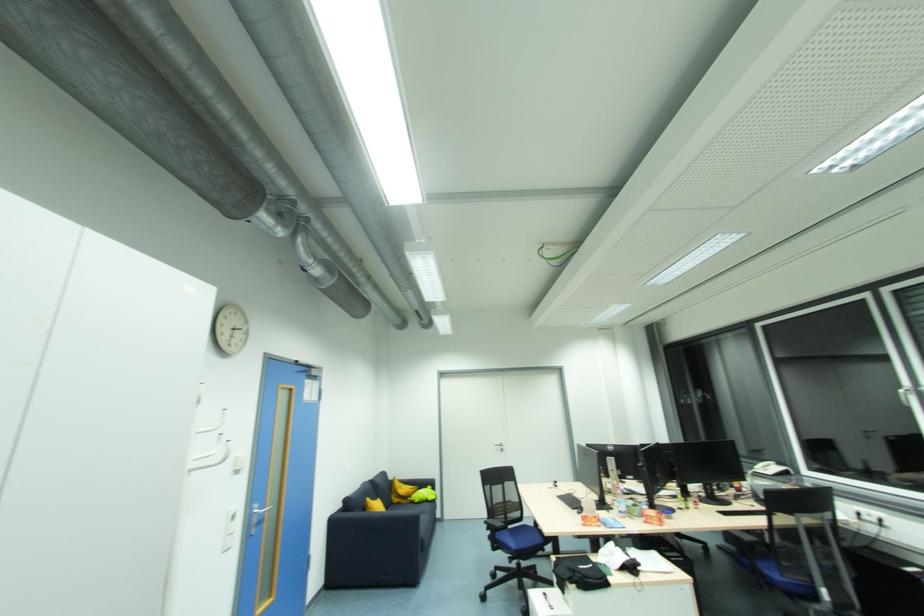
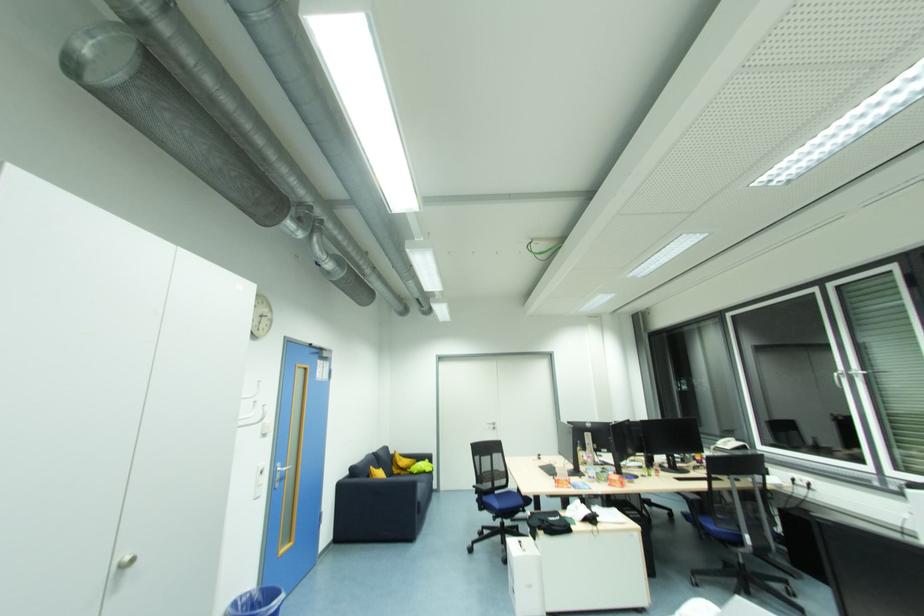
The point at (334, 525) is marked in the first image. Where is the corresponding point in the second image?

(343, 487)